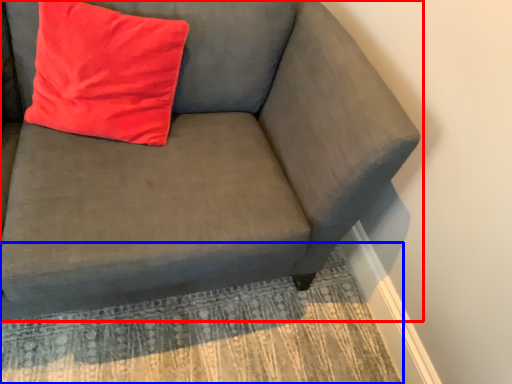
Question: Among these objects, which one is nearest to the camera, studio couch (highlighted by a red box) or mat (highlighted by a blue box)?

Choices:
 (A) studio couch
 (B) mat

Answer: (A)